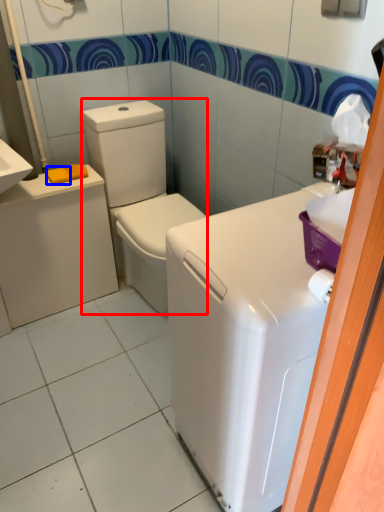
Question: Which object is closer to the camera taking this photo, washer (highlighted by a red box) or soap (highlighted by a blue box)?

Choices:
 (A) washer
 (B) soap

Answer: (A)